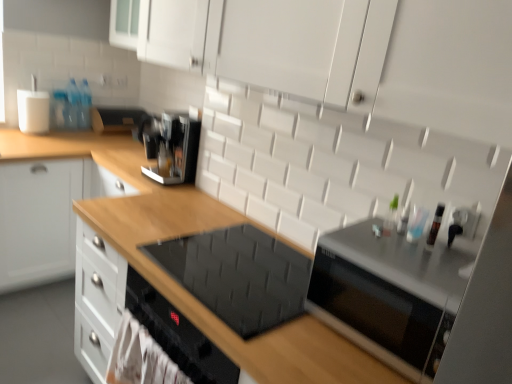
Question: Is transparent plastic bottle at upper right, marked as the second bottle in a back-to-front arrangement, inside the boundaries of black glass cooktop at center, or outside?

Choices:
 (A) inside
 (B) outside

Answer: (B)

Question: From the image's perspective, is transparent plastic bottle at upper right, the 1th bottle from the right, positioned above or below black glass cooktop at center?

Choices:
 (A) above
 (B) below

Answer: (A)

Question: Based on their relative distances, which object is nearer to the black glass cooktop at center?

Choices:
 (A) sleek metallic coffee maker at upper center
 (B) satin black toaster at upper center, arranged as the 2th appliance when ordered from the bottom
 (C) sleek metallic microwave at right, positioned as the 2th appliance in left-to-right order
 (D) wooden drawer at left
 (E) clear plastic bottle at upper left, the second bottle in the front-to-back sequence

Answer: (A)

Question: Which object is positioned closest to the transparent plastic bottle at upper right, the first bottle in the front-to-back sequence?

Choices:
 (A) sleek metallic coffee maker at upper center
 (B) sleek metallic microwave at right, the first appliance from the front
 (C) satin black toaster at upper center, the 2th appliance when ordered from front to back
 (D) black glass cooktop at center
 (E) wooden drawer at left

Answer: (B)